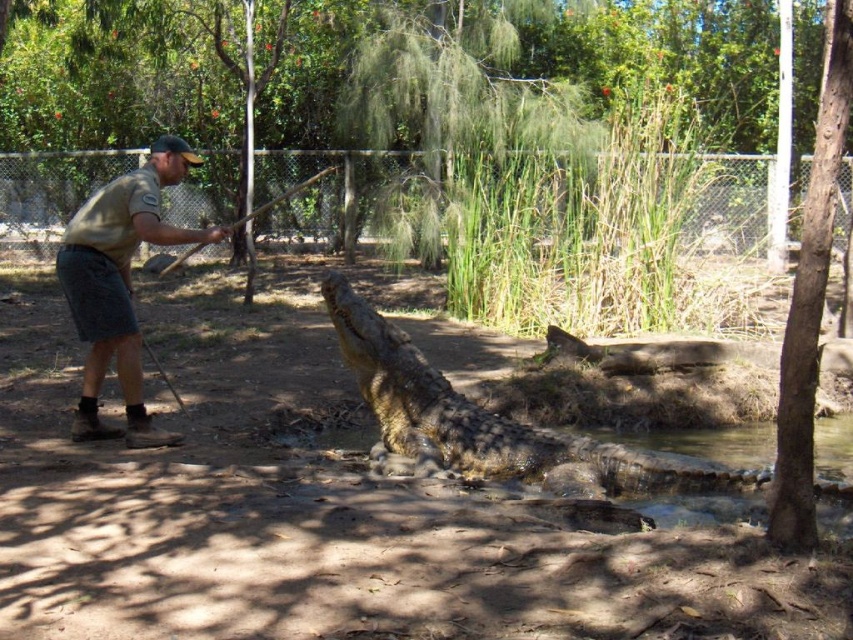
You are a wildlife photographer aiming to capture a closeup shot of the leathery brown crocodile at center. Your camera has a maximum zoom range of 5 meters. Can you get a clear closeup without moving closer physically?

The distance between you and the leathery brown crocodile at center is 5.98 meters, which exceeds your camera maximum zoom range of 5 meters. Therefore, you cannot get a clear closeup without moving closer physically.

You are a visitor at the wildlife park and want to know if the leathery brown crocodile at center is larger than the khaki uniform at left. Can you confirm this?

Yes, the leathery brown crocodile at center is bigger than the khaki uniform at left according to the description.

You are a park ranger who needs to safely approach the man and the crocodile in the scene. The coordinates you are given are point (490, 420). Where is this point located in relation to the man and the crocodile?

The point (490, 420) is located at the leathery brown crocodile at center, which is where the crocodile is positioned near the shallow water body, partially submerged with its head raised. The man is interacting with it using a long stick from the dry ground.